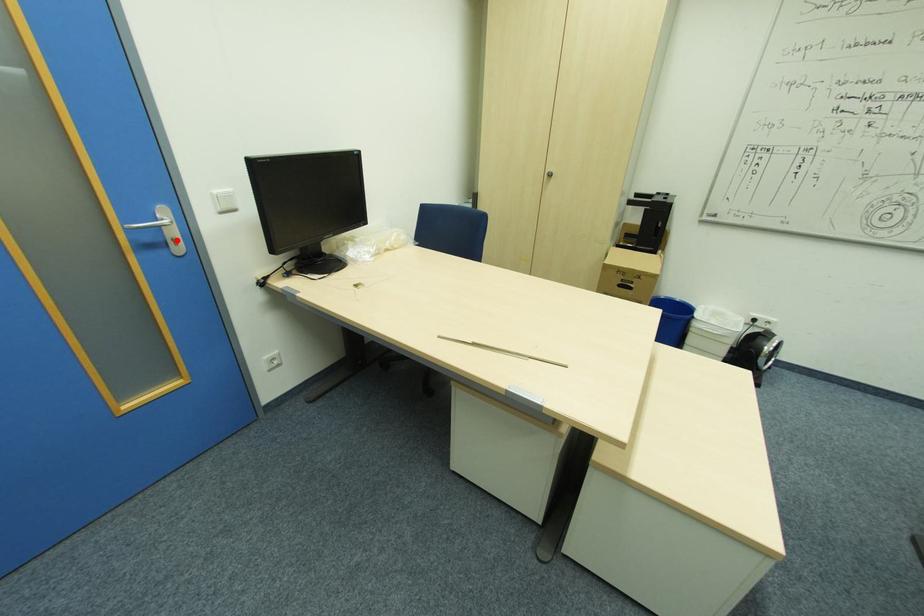
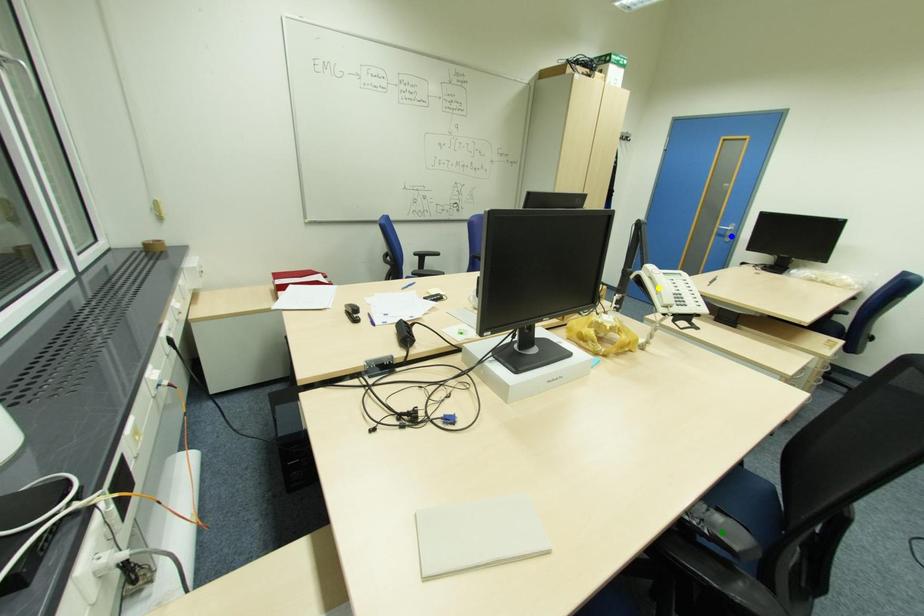
Question: I am providing you with two images of the same scene from different viewpoints. A red point is marked on the first image. You are given multiple points on the second image. In image 2, which mark is for the same physical point as the one in image 1?

Choices:
 (A) yellow point
 (B) green point
 (C) blue point

Answer: (C)